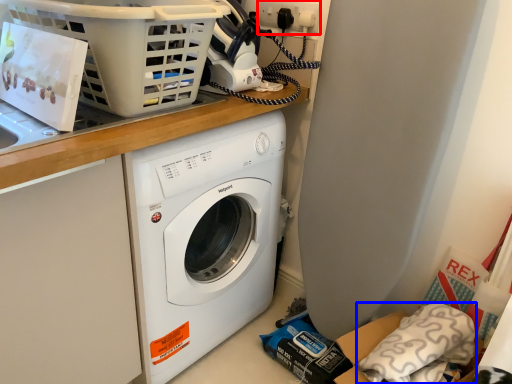
Question: Which of the following is the closest to the observer, electric outlet (highlighted by a red box) or pillow (highlighted by a blue box)?

Choices:
 (A) electric outlet
 (B) pillow

Answer: (B)